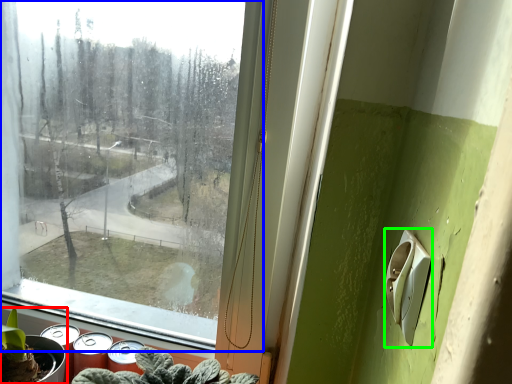
Question: Which object is positioned farthest from houseplant (highlighted by a red box)? Select from window (highlighted by a blue box) and light switch (highlighted by a green box).

Choices:
 (A) window
 (B) light switch

Answer: (A)